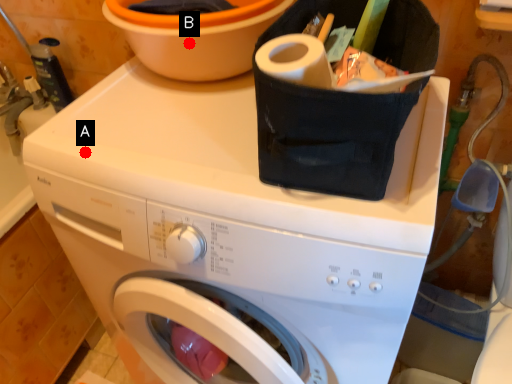
Question: Two points are circled on the image, labeled by A and B beside each circle. Which of the following is the farthest from the observer?

Choices:
 (A) A is further
 (B) B is further

Answer: (B)